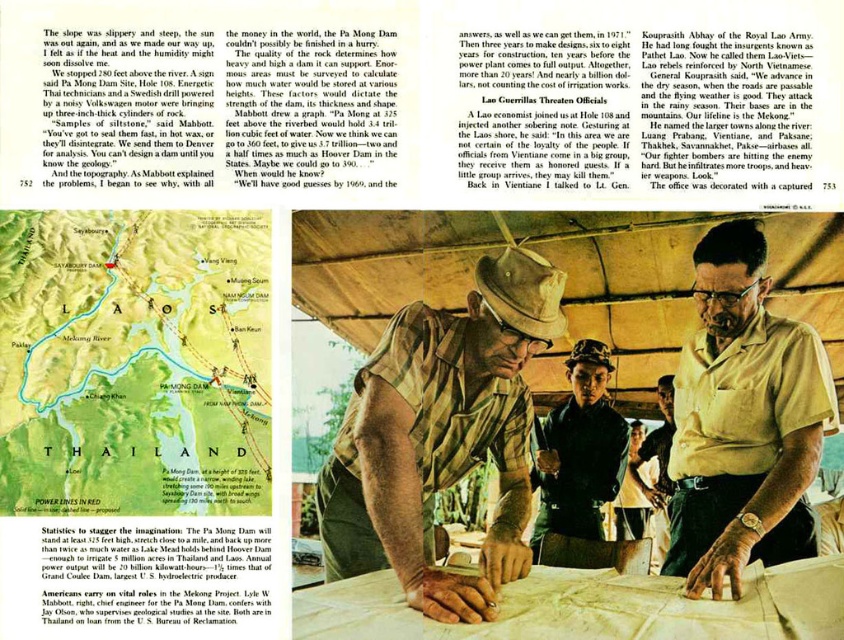
The image size is (844, 640). Describe the element at coordinates (441, 435) in the screenshot. I see `khaki fabric shirt at center` at that location.

Can you confirm if khaki fabric shirt at center is positioned above dark green uniform at center?

Yes, khaki fabric shirt at center is above dark green uniform at center.

This screenshot has height=640, width=844. I want to click on khaki fabric shirt at center, so click(441, 435).

Identify the location of khaki fabric shirt at center. Image resolution: width=844 pixels, height=640 pixels. (441, 435).

Which is in front, point (262, 406) or point (706, 573)?

Point (262, 406)

Between green paper map at bottom left and tan shirt at center, which one is positioned lower?

tan shirt at center is below.

Which is behind, point (268, 276) or point (766, 474)?

The point (766, 474) is behind.

The width and height of the screenshot is (844, 640). I want to click on green paper map at bottom left, so click(x=134, y=362).

Identify the location of tan shirt at center. (744, 420).

Does point (718, 268) lie behind point (545, 476)?

No, (718, 268) is in front of (545, 476).

Identify the location of tan shirt at center. The width and height of the screenshot is (844, 640). (744, 420).